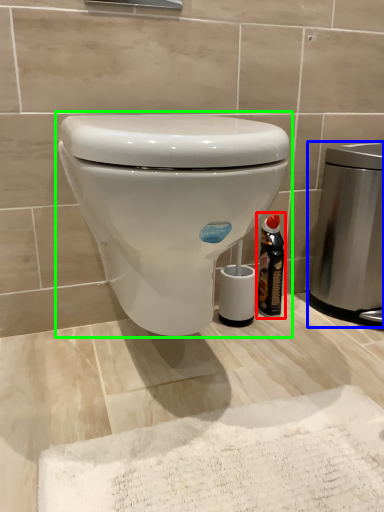
Question: Considering the real-world distances, which object is farthest from bottle (highlighted by a red box)? appliance (highlighted by a blue box) or toilet (highlighted by a green box)?

Choices:
 (A) appliance
 (B) toilet

Answer: (B)